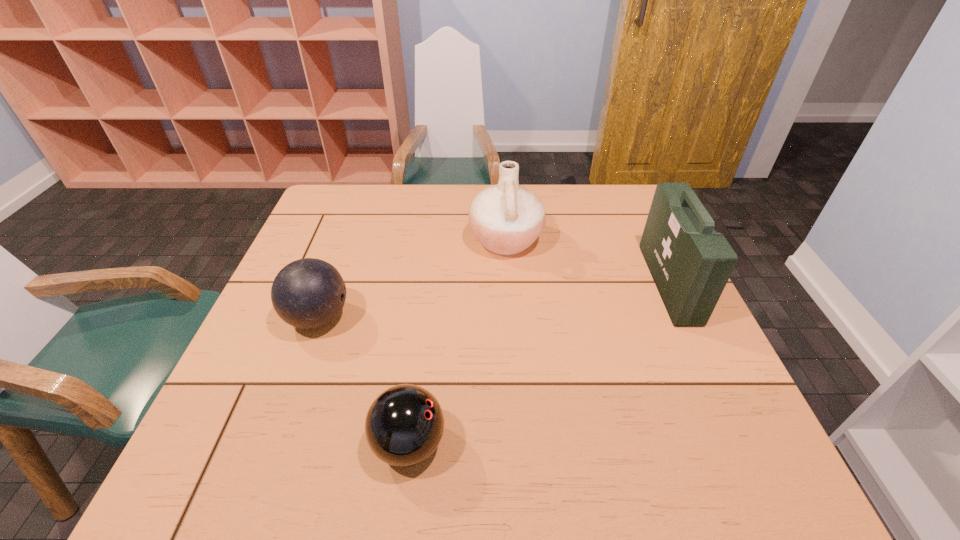
Identify the location of free spot between the third object from left to right and the nearer bowling ball. The width and height of the screenshot is (960, 540). [x=458, y=342].

Identify the location of free space between the shorter bowling ball and the left bowling ball. (364, 381).

Image resolution: width=960 pixels, height=540 pixels. Find the location of `free space between the shorter bowling ball and the first-aid kit`. free space between the shorter bowling ball and the first-aid kit is located at coordinates (539, 363).

Where is `vacant area that lies between the left bowling ball and the rightmost object`? vacant area that lies between the left bowling ball and the rightmost object is located at coordinates (493, 300).

This screenshot has width=960, height=540. In order to click on free spot between the farther bowling ball and the pottery in this screenshot , I will do `click(412, 279)`.

You are a GUI agent. You are given a task and a screenshot of the screen. Output one action in this format:
    pyautogui.click(x=<x>, y=<y>)
    Task: Click on the vacant area that lies between the first-aid kit and the third object from right to left
    This screenshot has width=960, height=540.
    Given the screenshot: What is the action you would take?
    pyautogui.click(x=539, y=363)

Locate which object is the second closest to the left bowling ball. Please provide its 2D coordinates. Your answer should be formatted as a tuple, i.e. [(x, y)], where the tuple contains the x and y coordinates of a point satisfying the conditions above.

[(506, 218)]

Locate which object ranks second in proximity to the second object from right to left. Please provide its 2D coordinates. Your answer should be formatted as a tuple, i.e. [(x, y)], where the tuple contains the x and y coordinates of a point satisfying the conditions above.

[(308, 293)]